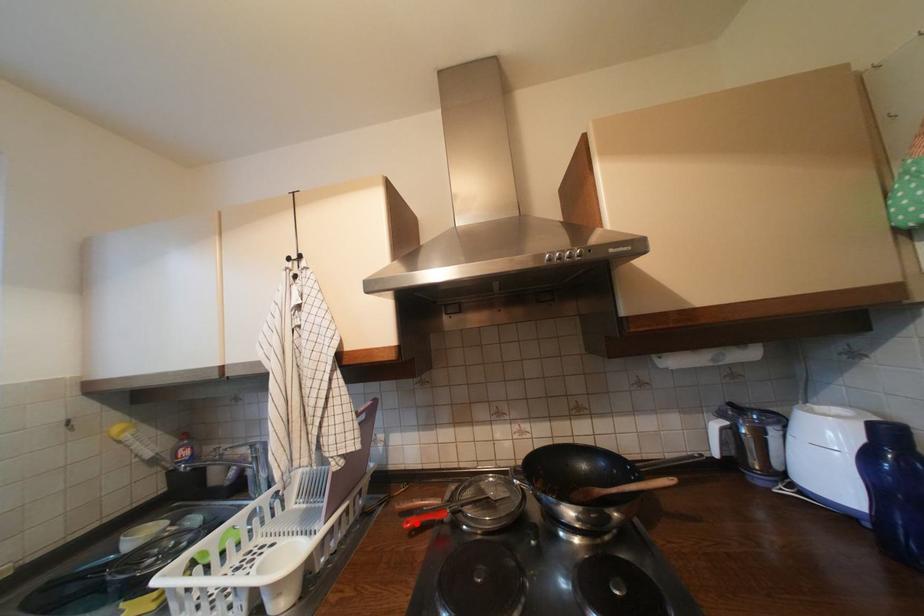
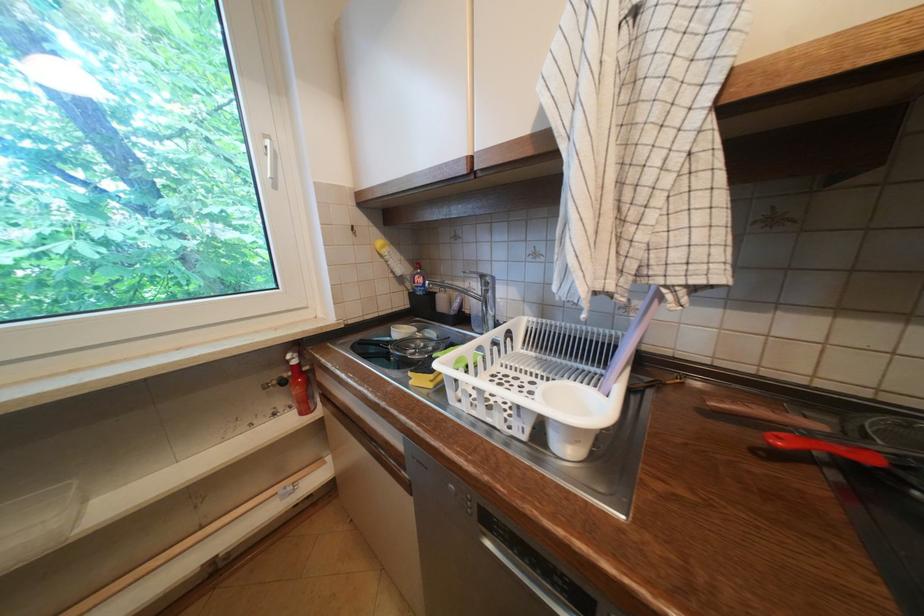
In the second image, find the point that corresponds to the highlighted location in the first image.

(788, 440)